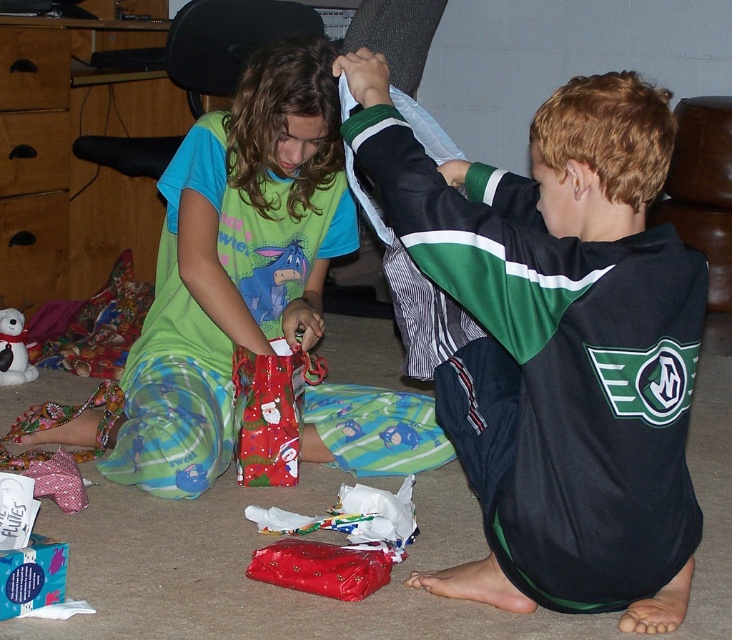
You are a parent trying to locate the shiny metallic gift bag at lower left for your child. Based on the scene, where would you find it relative to the matte green pajama pants at center?

The shiny metallic gift bag at lower left is behind the matte green pajama pants at center, so you can find it by looking behind the pants.

You are a photographer trying to capture a closeup of the cartoon donkey graphic on the girl wearing green t shirt with blue sleeves and green and blue pajama pants. The camera is currently focused on the point at coordinates point (234,264). Do you need to adjust the focus to capture the cartoon donkey graphic?

The point (234,264) is on matte green pajama pants at center, so yes, you need to adjust the focus to capture the cartoon donkey graphic on the girl wearing green t shirt with blue sleeves and green and blue pajama pants since the current focus is on the green pajama pants at center instead of the cartoon graphic on her shirt.